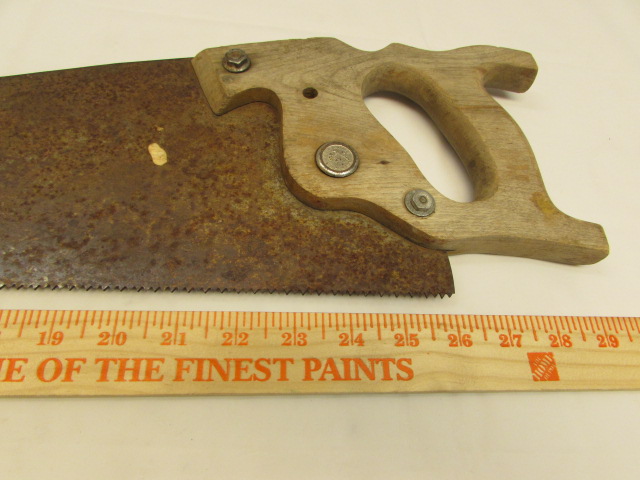
Identify the location of tabl. The image size is (640, 480). (230, 446).